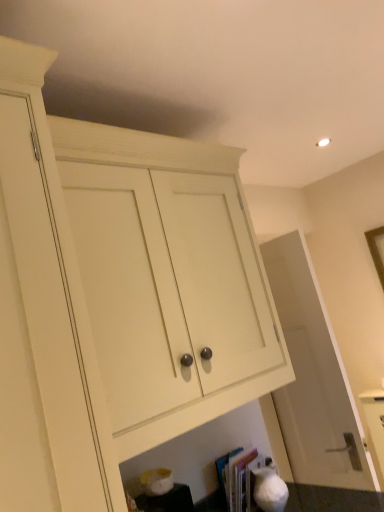
Question: Is point (105, 202) positioned closer to the camera than point (284, 335)?

Choices:
 (A) closer
 (B) farther

Answer: (A)

Question: From a real-world perspective, is white wood cabinet at center positioned above or below white matte door at center?

Choices:
 (A) below
 (B) above

Answer: (B)

Question: Considering the real-world distances, which object is farthest from the white wood cabinet at center?

Choices:
 (A) hardcover book at lower center
 (B) white matte door at center

Answer: (A)

Question: Estimate the real-world distances between objects in this image. Which object is closer to the white matte door at center?

Choices:
 (A) hardcover book at lower center
 (B) white wood cabinet at center

Answer: (A)